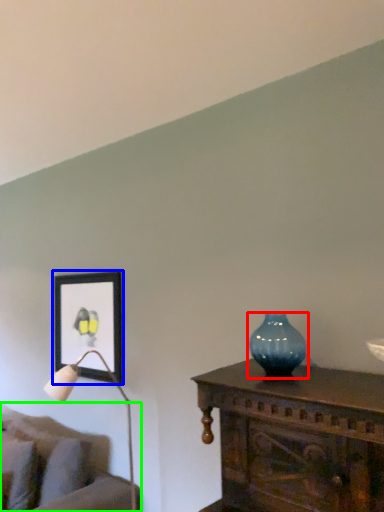
Question: Which object is positioned farthest from vase (highlighted by a red box)? Select from picture frame (highlighted by a blue box) and studio couch (highlighted by a green box).

Choices:
 (A) picture frame
 (B) studio couch

Answer: (B)